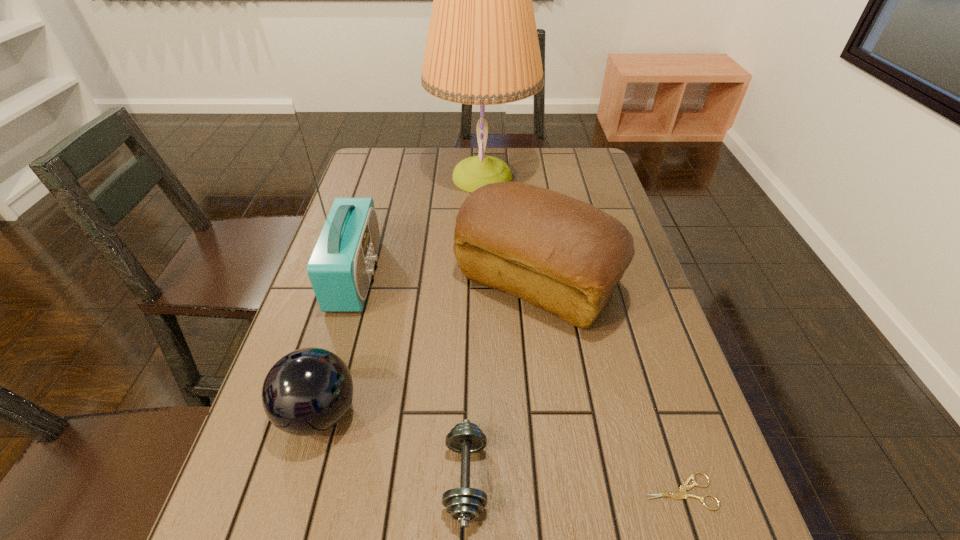
Where is `free space between the farthest object and the second tallest object`? This screenshot has height=540, width=960. free space between the farthest object and the second tallest object is located at coordinates (419, 226).

Locate an element on the screen. The height and width of the screenshot is (540, 960). vacant space that is in between the fifth shortest object and the bowling ball is located at coordinates (337, 344).

Locate an element on the screen. object that can be found as the fourth closest to the lamp is located at coordinates (464, 504).

Identify which object is the third nearest to the third tallest object. Please provide its 2D coordinates. Your answer should be formatted as a tuple, i.e. [(x, y)], where the tuple contains the x and y coordinates of a point satisfying the conditions above.

[(340, 268)]

Locate an element on the screen. The image size is (960, 540). vacant region that satisfies the following two spatial constraints: 1. on the side of the third shortest object with the finger holes; 2. on the back side of the shears is located at coordinates (297, 491).

Locate an element on the screen. blank space that satisfies the following two spatial constraints: 1. on the front panel of the radio receiver; 2. on the back side of the second shortest object is located at coordinates (296, 478).

At what (x,y) coordinates should I click in order to perform the action: click on free location that satisfies the following two spatial constraints: 1. on the side of the bowling ball with the finger holes; 2. on the right side of the shortest object. Please return your answer as a coordinate pair (x, y). The height and width of the screenshot is (540, 960). Looking at the image, I should click on (297, 491).

Where is `blank space that satisfies the following two spatial constraints: 1. on the side of the third shortest object with the finger holes; 2. on the back side of the shortest object`? The height and width of the screenshot is (540, 960). blank space that satisfies the following two spatial constraints: 1. on the side of the third shortest object with the finger holes; 2. on the back side of the shortest object is located at coordinates (297, 491).

Identify the location of vacant region that satisfies the following two spatial constraints: 1. on the side of the tallest object near the pull switch; 2. on the left side of the shortest object. (484, 491).

Find the location of a particular element. free space that satisfies the following two spatial constraints: 1. on the front panel of the radio receiver; 2. on the back side of the shears is located at coordinates (292, 491).